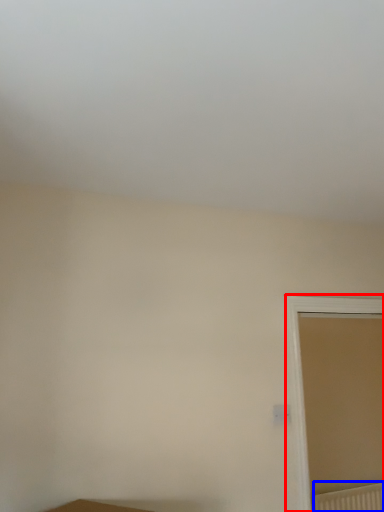
Question: Among these objects, which one is farthest to the camera, window (highlighted by a red box) or radiator (highlighted by a blue box)?

Choices:
 (A) window
 (B) radiator

Answer: (B)